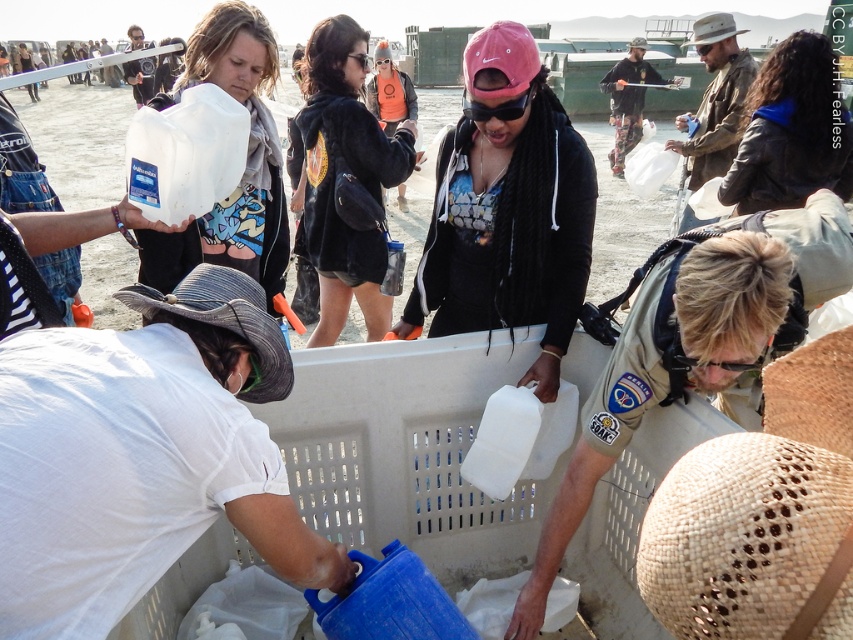
Between matte white jug at center and black fuzzy jacket at center, which one is positioned higher?

black fuzzy jacket at center is higher up.

Is point (585, 172) in front of point (312, 147)?

Yes, point (585, 172) is in front of point (312, 147).

Identify the location of matte white jug at center. This screenshot has width=853, height=640. (508, 209).

Which of these two, black fuzzy jacket at center or blue leather jacket at upper right, stands shorter?

With less height is blue leather jacket at upper right.

Locate an element on the screen. This screenshot has height=640, width=853. black fuzzy jacket at center is located at coordinates (351, 173).

At what (x,y) coordinates should I click in order to perform the action: click on black fuzzy jacket at center. Please return your answer as a coordinate pair (x, y). The image size is (853, 640). Looking at the image, I should click on (351, 173).

Is matte white jug at upper left smaller than blue leather jacket at upper right?

No, matte white jug at upper left is not smaller than blue leather jacket at upper right.

Which of these two, matte white jug at upper left or blue leather jacket at upper right, stands taller?

matte white jug at upper left

Where is `matte white jug at upper left`? Image resolution: width=853 pixels, height=640 pixels. matte white jug at upper left is located at coordinates (245, 163).

Find the location of `matte white jug at upper left`. matte white jug at upper left is located at coordinates (245, 163).